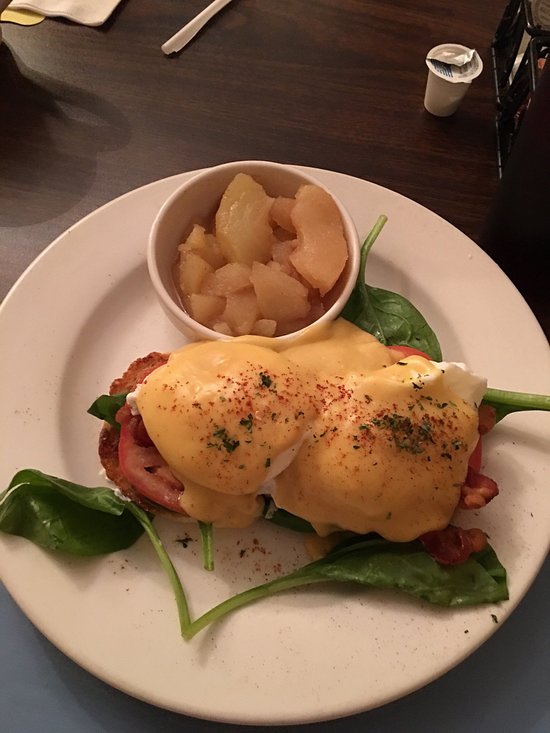
At what (x,y) coordinates should I click in order to perform the action: click on bowl. Please return your answer as a coordinate pair (x, y). The width and height of the screenshot is (550, 733). Looking at the image, I should click on (156, 237).